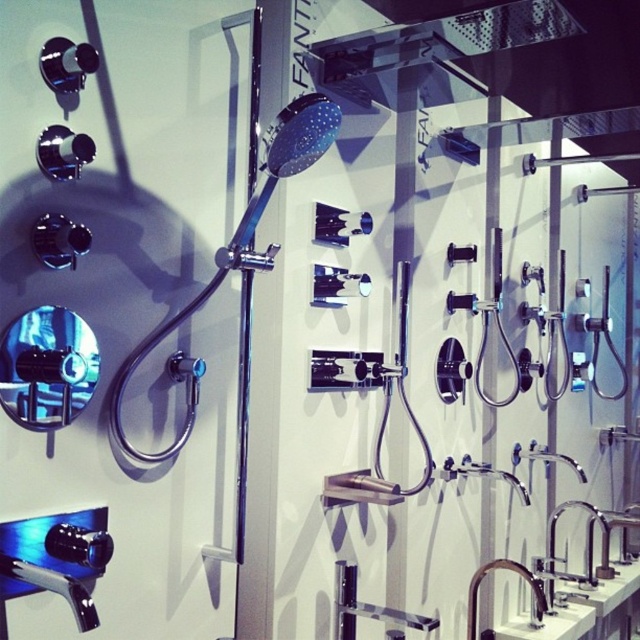
Question: Which object is positioned farthest from the polished chrome faucet at lower right?

Choices:
 (A) satin nickel faucet at lower right
 (B) white glossy sink at lower right
 (C) chrome/metallic faucet at center-right
 (D) chrome/metallic shower head at center-left

Answer: (D)

Question: Is chrome/metallic faucet at center-right smaller than satin nickel faucet at lower right?

Choices:
 (A) yes
 (B) no

Answer: (A)

Question: Which point is farther from the camera taking this photo?

Choices:
 (A) (484, 563)
 (B) (518, 621)

Answer: (B)

Question: Is white glossy sink at lower right above satin nickel faucet at lower right?

Choices:
 (A) no
 (B) yes

Answer: (A)

Question: Which of the following is the closest to the observer?

Choices:
 (A) chrome/metallic faucet at center-right
 (B) satin nickel faucet at lower right
 (C) polished chrome faucet at lower right

Answer: (C)

Question: Considering the relative positions of chrome/metallic shower head at center-left and polished chrome faucet at lower right in the image provided, where is chrome/metallic shower head at center-left located with respect to polished chrome faucet at lower right?

Choices:
 (A) below
 (B) above

Answer: (B)